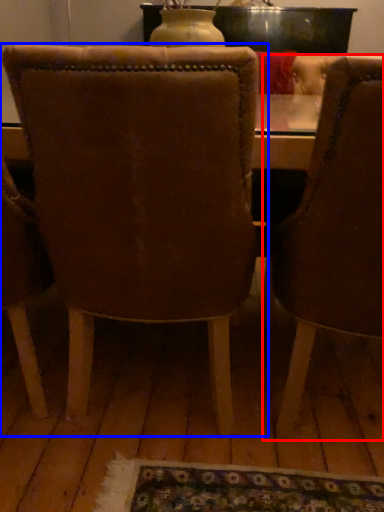
Question: Which object appears farthest to the camera in this image, chair (highlighted by a red box) or chair (highlighted by a blue box)?

Choices:
 (A) chair
 (B) chair

Answer: (B)